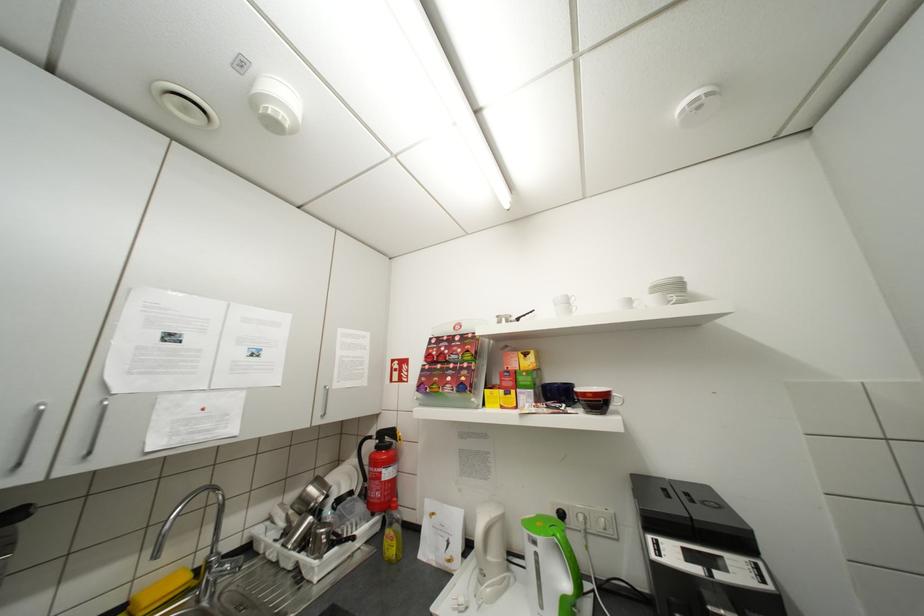
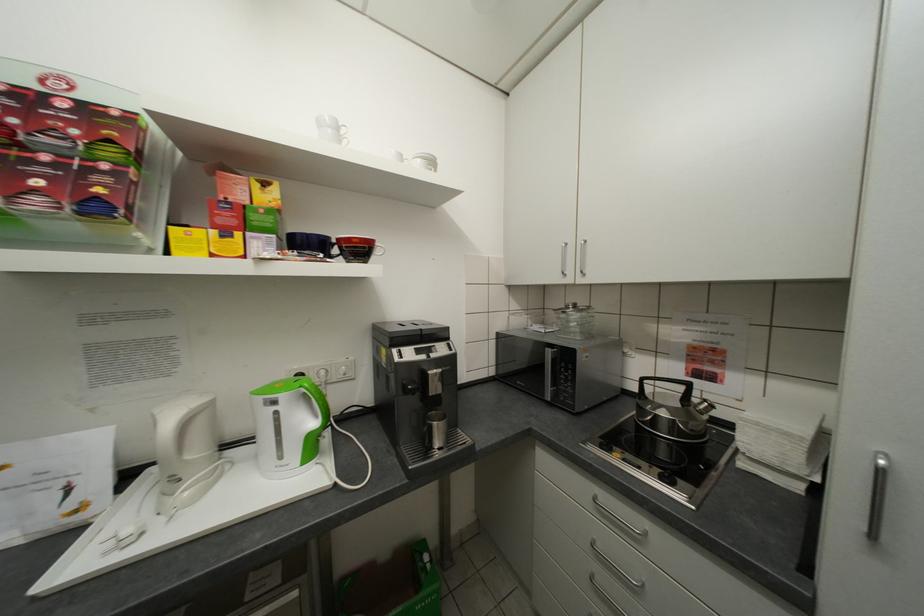
Question: Based on the continuous images, in which direction is the camera rotating? Reply with the corresponding letter.

Choices:
 (A) Left
 (B) Right
 (C) Up
 (D) Down

Answer: (B)